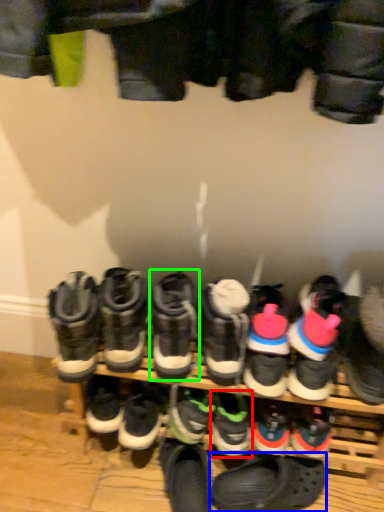
Question: Considering the real-world distances, which object is farthest from footwear (highlighted by a red box)? footwear (highlighted by a blue box) or footwear (highlighted by a green box)?

Choices:
 (A) footwear
 (B) footwear

Answer: (B)